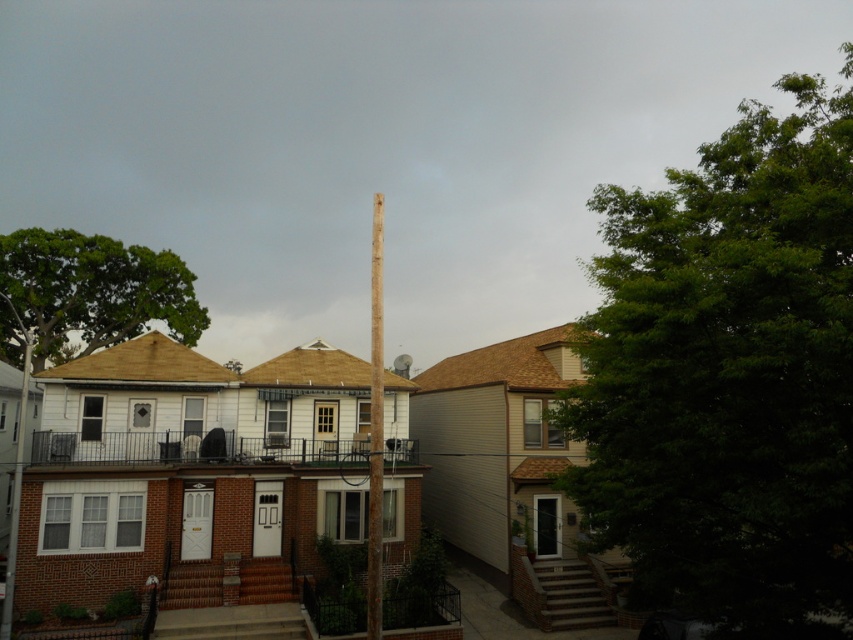
Is green leafy tree at upper left positioned in front of brown wooden telegraph pole at left?

No.

The image size is (853, 640). Identify the location of green leafy tree at upper left. (94, 291).

Is green leafy tree at upper left to the right of smooth brown wooden pole at center from the viewer's perspective?

No, green leafy tree at upper left is not to the right of smooth brown wooden pole at center.

Does green leafy tree at upper left have a greater height compared to smooth brown wooden pole at center?

Incorrect, green leafy tree at upper left's height is not larger of smooth brown wooden pole at center's.

This screenshot has width=853, height=640. Describe the element at coordinates (94, 291) in the screenshot. I see `green leafy tree at upper left` at that location.

The height and width of the screenshot is (640, 853). In order to click on green leafy tree at upper left in this screenshot , I will do `click(94, 291)`.

Which of these two, green leafy tree at right or green leafy tree at upper left, stands shorter?

green leafy tree at upper left is shorter.

Measure the distance between point (839, 323) and camera.

Point (839, 323) and camera are 6.20 meters apart from each other.

Locate an element on the screen. Image resolution: width=853 pixels, height=640 pixels. green leafy tree at right is located at coordinates (729, 376).